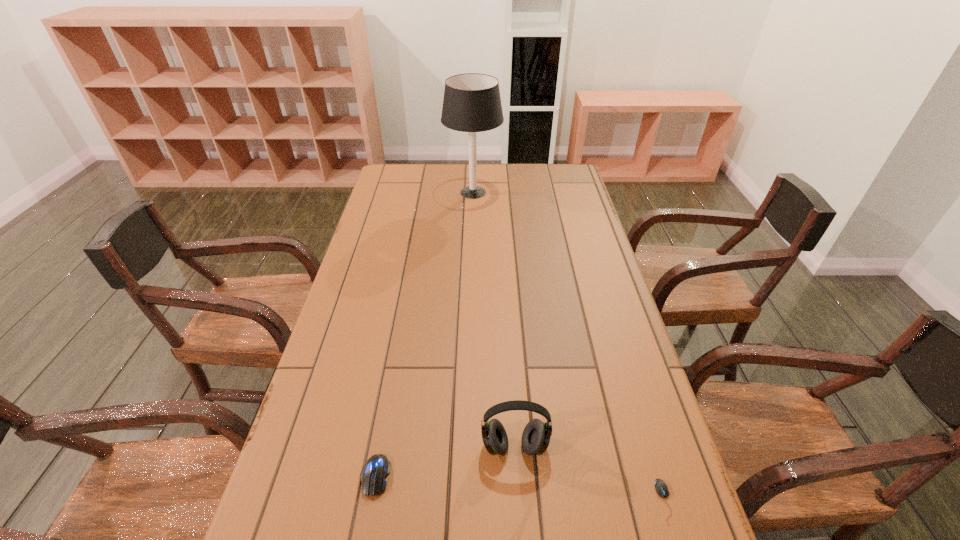
Image resolution: width=960 pixels, height=540 pixels. I want to click on the tallest object, so click(x=472, y=103).

The height and width of the screenshot is (540, 960). Find the location of `the farthest object`. the farthest object is located at coordinates (472, 103).

You are a GUI agent. You are given a task and a screenshot of the screen. Output one action in this format:
    pyautogui.click(x=<x>, y=<y>)
    Task: Click on the third shortest object
    
    Given the screenshot: What is the action you would take?
    pyautogui.click(x=536, y=436)

I want to click on the leftmost object, so click(374, 472).

Find the location of a particular element. The height and width of the screenshot is (540, 960). the left mouse is located at coordinates (374, 472).

Find the location of a particular element. Image resolution: width=960 pixels, height=540 pixels. the shortest object is located at coordinates (661, 488).

Find the location of `the rightmost object`. the rightmost object is located at coordinates (661, 488).

The image size is (960, 540). I want to click on vacant area situated 0.120m on the front of the tallest object, so click(472, 226).

At what (x,y) coordinates should I click in order to perform the action: click on vacant point located 0.140m on the ear cups of the headset. Please return your answer as a coordinate pair (x, y). The width and height of the screenshot is (960, 540). Looking at the image, I should click on (520, 538).

The height and width of the screenshot is (540, 960). I want to click on free location located 0.320m on the left of the right mouse, so click(493, 501).